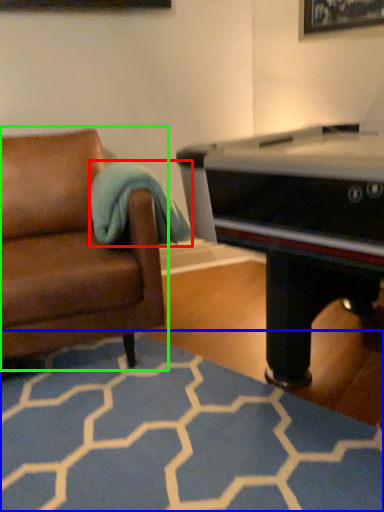
Question: Considering the real-world distances, which object is closest to blanket (highlighted by a red box)? plain (highlighted by a blue box) or studio couch (highlighted by a green box).

Choices:
 (A) plain
 (B) studio couch

Answer: (B)